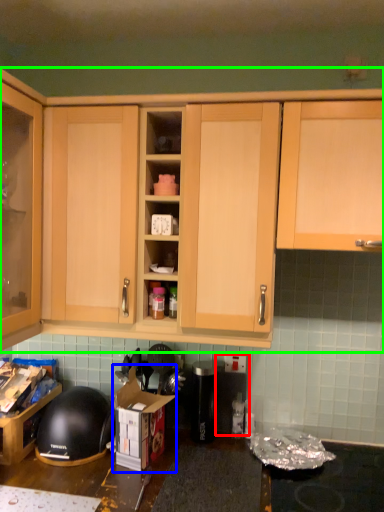
Question: Which is farther away from appliance (highlighted by a red box)? cardboard box (highlighted by a blue box) or cabinetry (highlighted by a green box)?

Choices:
 (A) cardboard box
 (B) cabinetry

Answer: (B)